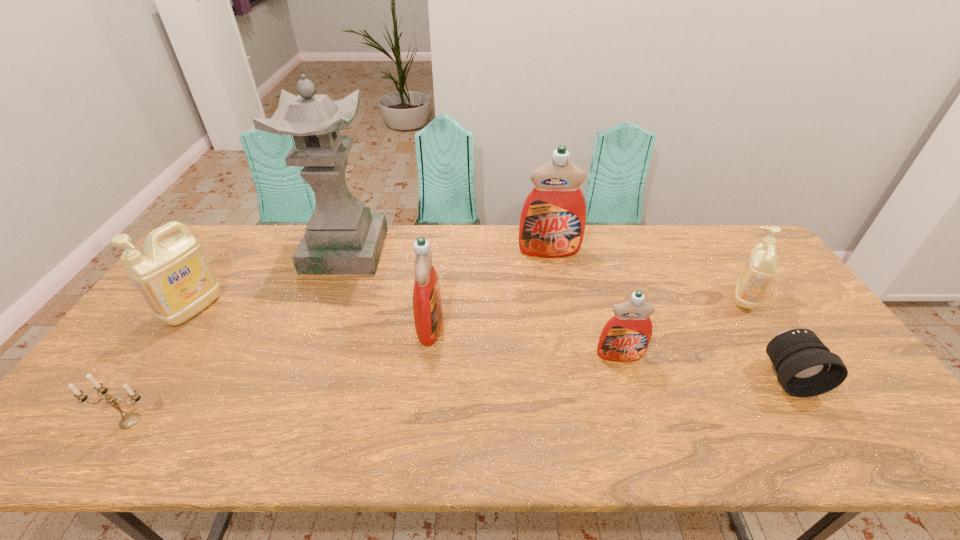
Identify the location of vacant space located 0.090m on the front surface of the smallest red detergent. (632, 393).

Locate an element on the screen. The height and width of the screenshot is (540, 960). vacant region located 0.190m on the right of the nearest object is located at coordinates (242, 421).

Locate an element on the screen. The height and width of the screenshot is (540, 960). free spot located 0.140m at the front element of the black telephoto lens is located at coordinates (838, 454).

Where is `sculpture that is at the far edge`? The image size is (960, 540). sculpture that is at the far edge is located at coordinates (342, 237).

Locate an element on the screen. This screenshot has width=960, height=540. detergent present at the far edge is located at coordinates (552, 223).

The width and height of the screenshot is (960, 540). I want to click on object present at the near edge, so click(x=129, y=420).

In order to click on detergent that is at the left edge in this screenshot , I will do tap(174, 277).

Find the location of `candle that is at the left edge`. candle that is at the left edge is located at coordinates (129, 420).

Find the location of a particular element. The width and height of the screenshot is (960, 540). detergent that is at the right edge is located at coordinates (761, 266).

I want to click on telephoto lens positioned at the right edge, so click(805, 366).